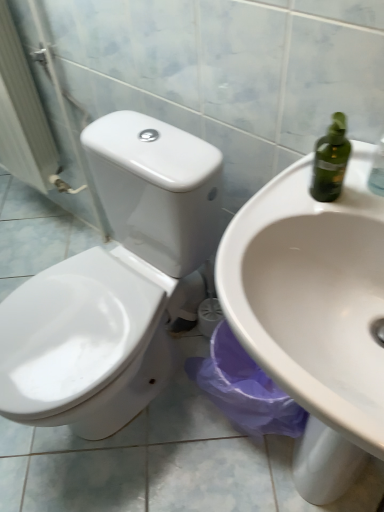
Where is `white glossy toilet at left`? white glossy toilet at left is located at coordinates (34, 120).

Considering their positions, is white glossy toilet at left located in front of or behind white glossy sink at center?

white glossy toilet at left is positioned farther from the viewer than white glossy sink at center.

Considering the relative positions of white glossy toilet at left and white glossy sink at center in the image provided, is white glossy toilet at left to the left of white glossy sink at center from the viewer's perspective?

Yes.

From the image's perspective, which one is positioned higher, white glossy toilet at left or white glossy sink at center?

white glossy toilet at left is shown above in the image.

How different are the orientations of white glossy toilet at left and white glossy sink at center in degrees?

The angular difference between white glossy toilet at left and white glossy sink at center is 1.86 degrees.

From the image's perspective, between white glossy toilet at center and white glossy toilet at left, who is located below?

white glossy toilet at center is shown below in the image.

Consider the image. Is white glossy toilet at center aimed at white glossy toilet at left?

No, white glossy toilet at center is not aimed at white glossy toilet at left.

Considering the positions of objects white glossy toilet at center and white glossy toilet at left in the image provided, who is behind, white glossy toilet at center or white glossy toilet at left?

white glossy toilet at left.

Can you confirm if white glossy toilet at center is wider than white glossy toilet at left?

Answer: Yes, white glossy toilet at center is wider than white glossy toilet at left.

Considering the positions of points (50, 282) and (331, 433), is point (50, 282) closer to camera compared to point (331, 433)?

That is False.

Considering the sizes of white glossy toilet at center and white glossy sink at center in the image, is white glossy toilet at center wider or thinner than white glossy sink at center?

Considering their sizes, white glossy toilet at center looks broader than white glossy sink at center.

Can we say white glossy toilet at center lies outside white glossy sink at center?

Absolutely, white glossy toilet at center is external to white glossy sink at center.

Considering the positions of objects white glossy toilet at center and white glossy sink at center in the image provided, who is more to the right, white glossy toilet at center or white glossy sink at center?

white glossy sink at center is more to the right.

Is white glossy toilet at left situated inside white glossy toilet at center or outside?

white glossy toilet at left is not enclosed by white glossy toilet at center.

From the image's perspective, is white glossy toilet at left above white glossy toilet at center?

Correct, white glossy toilet at left appears higher than white glossy toilet at center in the image.

Is point (54, 80) positioned in front of point (37, 340)?

No, it is not.

Which of these two, white glossy sink at center or white glossy toilet at left, stands shorter?

white glossy sink at center.

Which object is closer to the camera, white glossy sink at center or white glossy toilet at left?

white glossy sink at center is closer to the camera.

Considering the relative sizes of white glossy sink at center and white glossy toilet at left in the image provided, is white glossy sink at center wider than white glossy toilet at left?

Yes.

Who is bigger, white glossy sink at center or white glossy toilet at center?

white glossy toilet at center is bigger.

In the scene shown: Measure the distance from white glossy sink at center to white glossy toilet at center.

white glossy sink at center and white glossy toilet at center are 39.83 centimeters apart from each other.

Could you tell me if white glossy sink at center is turned towards white glossy toilet at center?

No, white glossy sink at center is not aimed at white glossy toilet at center.

This screenshot has height=512, width=384. In order to click on screen door lying behind the white glossy sink at center in this screenshot , I will do `click(34, 120)`.

The width and height of the screenshot is (384, 512). Identify the location of screen door that is on the left side of white glossy toilet at center. (34, 120).

From the image, which object appears to be farther from white glossy toilet at center, white glossy toilet at left or white glossy sink at center?

white glossy toilet at left.

When comparing their distances from white glossy sink at center, does white glossy toilet at left or white glossy toilet at center seem closer?

Based on the image, white glossy toilet at center appears to be nearer to white glossy sink at center.

Based on their spatial positions, is white glossy sink at center or white glossy toilet at center further from white glossy toilet at left?

Based on the image, white glossy sink at center appears to be further to white glossy toilet at left.

Looking at the image, which one is located closer to white glossy sink at center, white glossy toilet at center or white glossy toilet at left?

Based on the image, white glossy toilet at center appears to be nearer to white glossy sink at center.

Based on their spatial positions, is white glossy sink at center or white glossy toilet at left further from white glossy toilet at center?

white glossy toilet at left is positioned further to the anchor white glossy toilet at center.

Based on their spatial positions, is white glossy toilet at center or white glossy sink at center closer to white glossy toilet at left?

Based on the image, white glossy toilet at center appears to be nearer to white glossy toilet at left.

Where is `toilet located between white glossy toilet at left and white glossy sink at center in the left-right direction`? toilet located between white glossy toilet at left and white glossy sink at center in the left-right direction is located at coordinates (113, 283).